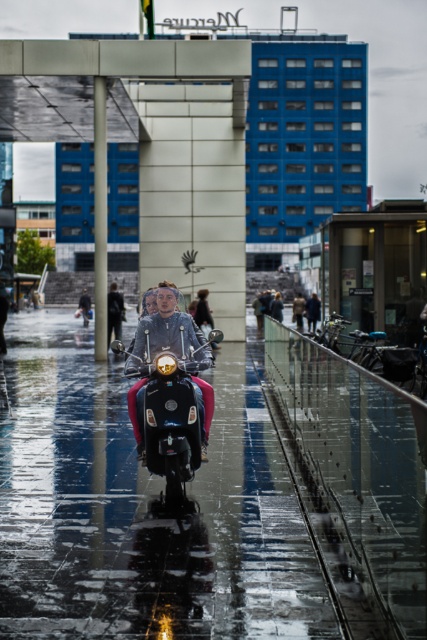
You are a GUI agent. You are given a task and a screenshot of the screen. Output one action in this format:
    pyautogui.click(x=<x>, y=<y>)
    Task: Click on the shiny black scooter at center
    
    Given the screenshot: What is the action you would take?
    pyautogui.click(x=169, y=417)

Does shiny black scooter at center lie behind matte gray jacket at center?

No.

Measure the distance between shiny black scooter at center and camera.

They are 6.72 meters apart.

You are a GUI agent. You are given a task and a screenshot of the screen. Output one action in this format:
    pyautogui.click(x=<x>, y=<y>)
    Task: Click on the shiny black scooter at center
    This screenshot has height=640, width=427.
    Given the screenshot: What is the action you would take?
    pyautogui.click(x=169, y=417)